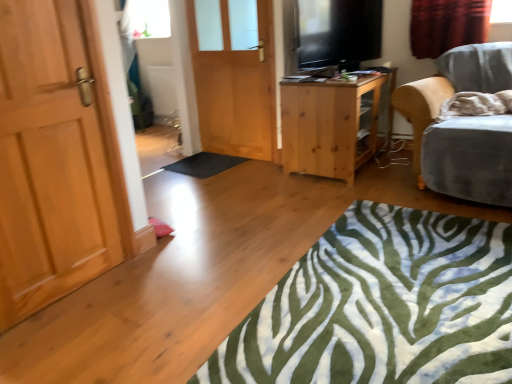
This screenshot has height=384, width=512. I want to click on free space that is in between velvet grey chair at right and green zebra-patterned rug at lower center, so click(381, 182).